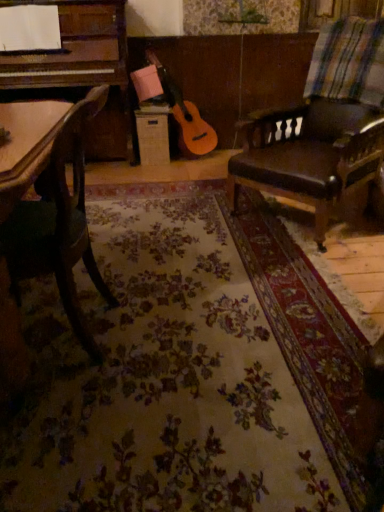
Question: Can you confirm if leather cushioned chair at right, which appears as the first chair when viewed from the back, is thinner than multicolored woven blanket at upper right?

Choices:
 (A) no
 (B) yes

Answer: (A)

Question: From the image's perspective, does leather cushioned chair at right, arranged as the 1th chair when viewed from the right, appear lower than multicolored woven blanket at upper right?

Choices:
 (A) yes
 (B) no

Answer: (A)

Question: Does leather cushioned chair at right, which appears as the first chair when viewed from the back, have a larger size compared to multicolored woven blanket at upper right?

Choices:
 (A) no
 (B) yes

Answer: (B)

Question: Could you tell me if leather cushioned chair at right, which appears as the first chair when viewed from the back, is facing multicolored woven blanket at upper right?

Choices:
 (A) yes
 (B) no

Answer: (B)

Question: Considering the relative positions of leather cushioned chair at right, the second chair positioned from the left, and multicolored woven blanket at upper right in the image provided, is leather cushioned chair at right, the second chair positioned from the left, in front of multicolored woven blanket at upper right?

Choices:
 (A) yes
 (B) no

Answer: (A)

Question: In terms of height, does leather cushioned chair at right, the second chair positioned from the left, look taller or shorter compared to green fabric chair at left, which is counted as the 1th chair, starting from the front?

Choices:
 (A) short
 (B) tall

Answer: (B)

Question: Based on their positions, is leather cushioned chair at right, arranged as the 1th chair when viewed from the right, located to the left or right of green fabric chair at left, the first chair positioned from the left?

Choices:
 (A) left
 (B) right

Answer: (B)

Question: Considering the positions of point (256, 117) and point (89, 276), is point (256, 117) closer or farther from the camera than point (89, 276)?

Choices:
 (A) farther
 (B) closer

Answer: (A)

Question: Is leather cushioned chair at right, the second chair positioned from the left, inside the boundaries of green fabric chair at left, which is the second chair from right to left, or outside?

Choices:
 (A) outside
 (B) inside

Answer: (A)

Question: From their relative heights in the image, would you say leather cushioned chair at right, which is the second chair in front-to-back order, is taller or shorter than multicolored woven blanket at upper right?

Choices:
 (A) tall
 (B) short

Answer: (A)

Question: Is leather cushioned chair at right, which is the second chair in front-to-back order, to the left or to the right of multicolored woven blanket at upper right in the image?

Choices:
 (A) left
 (B) right

Answer: (A)

Question: Considering the positions of leather cushioned chair at right, which is the second chair in front-to-back order, and multicolored woven blanket at upper right in the image, is leather cushioned chair at right, which is the second chair in front-to-back order, wider or thinner than multicolored woven blanket at upper right?

Choices:
 (A) wide
 (B) thin

Answer: (A)

Question: Is leather cushioned chair at right, the second chair positioned from the left, bigger or smaller than multicolored woven blanket at upper right?

Choices:
 (A) big
 (B) small

Answer: (A)

Question: Is green fabric chair at left, which is counted as the 1th chair, starting from the front, situated inside multicolored woven blanket at upper right or outside?

Choices:
 (A) inside
 (B) outside

Answer: (B)

Question: Would you say green fabric chair at left, the second chair from the back, is to the left or to the right of multicolored woven blanket at upper right in the picture?

Choices:
 (A) right
 (B) left

Answer: (B)